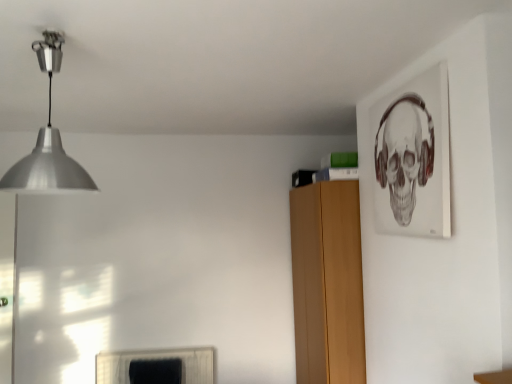
Find the location of a particular element. silver metallic pendant light at upper left is located at coordinates click(x=48, y=142).

What do you see at coordinates (48, 142) in the screenshot? I see `silver metallic pendant light at upper left` at bounding box center [48, 142].

Identify the location of matte paper skull at upper right. (413, 157).

Image resolution: width=512 pixels, height=384 pixels. Describe the element at coordinates (413, 157) in the screenshot. I see `matte paper skull at upper right` at that location.

In order to face matte paper skull at upper right, should I rotate leftwards or rightwards?

To align with it, rotate right about 19.179°.

This screenshot has width=512, height=384. Identify the location of silver metallic pendant light at upper left. (48, 142).

Which object is positioned more to the left, silver metallic pendant light at upper left or matte paper skull at upper right?

Positioned to the left is silver metallic pendant light at upper left.

Is silver metallic pendant light at upper left closer to the viewer compared to matte paper skull at upper right?

Yes, the depth of silver metallic pendant light at upper left is less than that of matte paper skull at upper right.

Between point (89, 187) and point (448, 230), which one is positioned behind?

Positioned behind is point (448, 230).

From the image's perspective, is silver metallic pendant light at upper left positioned above or below matte paper skull at upper right?

From the image's perspective, silver metallic pendant light at upper left appears above matte paper skull at upper right.

In the scene shown: From a real-world perspective, is silver metallic pendant light at upper left on top of matte paper skull at upper right?

Indeed, from a real-world perspective, silver metallic pendant light at upper left stands above matte paper skull at upper right.

Consider the image. Which of these two, silver metallic pendant light at upper left or matte paper skull at upper right, is thinner?

matte paper skull at upper right.

Considering the relative sizes of silver metallic pendant light at upper left and matte paper skull at upper right in the image provided, is silver metallic pendant light at upper left shorter than matte paper skull at upper right?

Yes, silver metallic pendant light at upper left is shorter than matte paper skull at upper right.

Between silver metallic pendant light at upper left and matte paper skull at upper right, which one has smaller size?

With smaller size is matte paper skull at upper right.

Could matte paper skull at upper right be considered to be inside silver metallic pendant light at upper left?

Actually, matte paper skull at upper right is outside silver metallic pendant light at upper left.

Is silver metallic pendant light at upper left next to matte paper skull at upper right?

silver metallic pendant light at upper left and matte paper skull at upper right are not in contact.

Is silver metallic pendant light at upper left facing towards matte paper skull at upper right?

Yes.

How many degrees apart are the facing directions of silver metallic pendant light at upper left and matte paper skull at upper right?

There is a 174-degree angle between the facing directions of silver metallic pendant light at upper left and matte paper skull at upper right.

Could you measure the distance between silver metallic pendant light at upper left and matte paper skull at upper right?

silver metallic pendant light at upper left is 5.08 feet away from matte paper skull at upper right.

Where is `lamp lying above the matte paper skull at upper right (from the image's perspective)`? The height and width of the screenshot is (384, 512). lamp lying above the matte paper skull at upper right (from the image's perspective) is located at coordinates (48, 142).

Is matte paper skull at upper right at the left side of silver metallic pendant light at upper left?

No, matte paper skull at upper right is not to the left of silver metallic pendant light at upper left.

Is matte paper skull at upper right further to the viewer compared to silver metallic pendant light at upper left?

Yes, the depth of matte paper skull at upper right is greater than that of silver metallic pendant light at upper left.

Between point (433, 212) and point (5, 188), which one is positioned behind?

Positioned behind is point (433, 212).

From the image's perspective, which one is positioned lower, matte paper skull at upper right or silver metallic pendant light at upper left?

matte paper skull at upper right appears lower in the image.

From a real-world perspective, which is physically above, matte paper skull at upper right or silver metallic pendant light at upper left?

silver metallic pendant light at upper left.

Is matte paper skull at upper right wider than silver metallic pendant light at upper left?

No.

Does matte paper skull at upper right have a lesser height compared to silver metallic pendant light at upper left?

No.

Does matte paper skull at upper right have a smaller size compared to silver metallic pendant light at upper left?

Correct, matte paper skull at upper right occupies less space than silver metallic pendant light at upper left.

Is matte paper skull at upper right spatially inside silver metallic pendant light at upper left, or outside of it?

matte paper skull at upper right lies outside silver metallic pendant light at upper left.

Is matte paper skull at upper right far away from silver metallic pendant light at upper left?

matte paper skull at upper right is far away from silver metallic pendant light at upper left.

Could you tell me if matte paper skull at upper right is turned towards silver metallic pendant light at upper left?

Yes, matte paper skull at upper right is turned towards silver metallic pendant light at upper left.

Locate an element on the screen. The image size is (512, 384). picture frame on the right of silver metallic pendant light at upper left is located at coordinates (413, 157).

The width and height of the screenshot is (512, 384). I want to click on lamp that is above the matte paper skull at upper right (from a real-world perspective), so click(48, 142).

Locate an element on the screen. The image size is (512, 384). picture frame on the right of silver metallic pendant light at upper left is located at coordinates (413, 157).